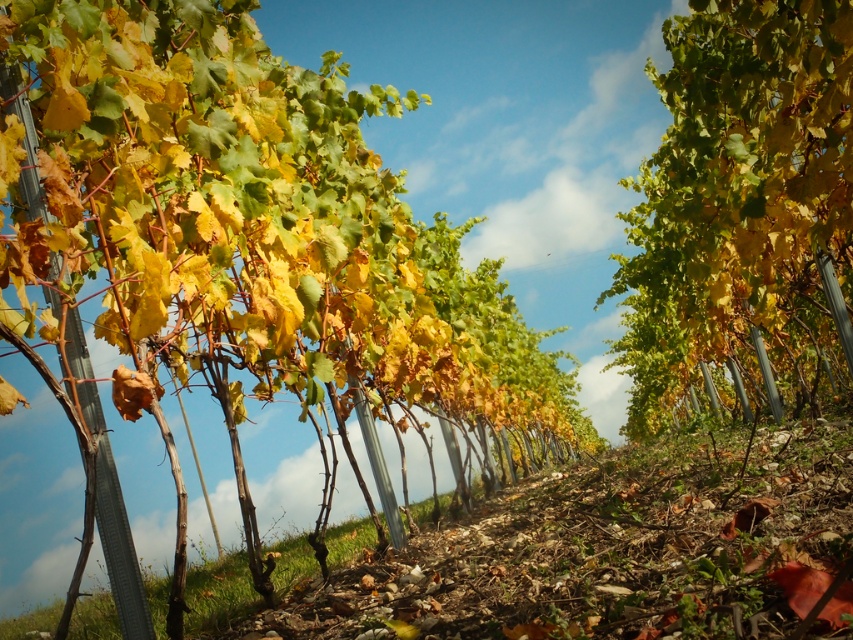
The height and width of the screenshot is (640, 853). I want to click on green leafy vine at center, so click(x=239, y=237).

Consider the image. Which is more to the right, green leafy vine at center or yellow-green foliage at center?

From the viewer's perspective, yellow-green foliage at center appears more on the right side.

This screenshot has width=853, height=640. I want to click on green leafy vine at center, so click(x=239, y=237).